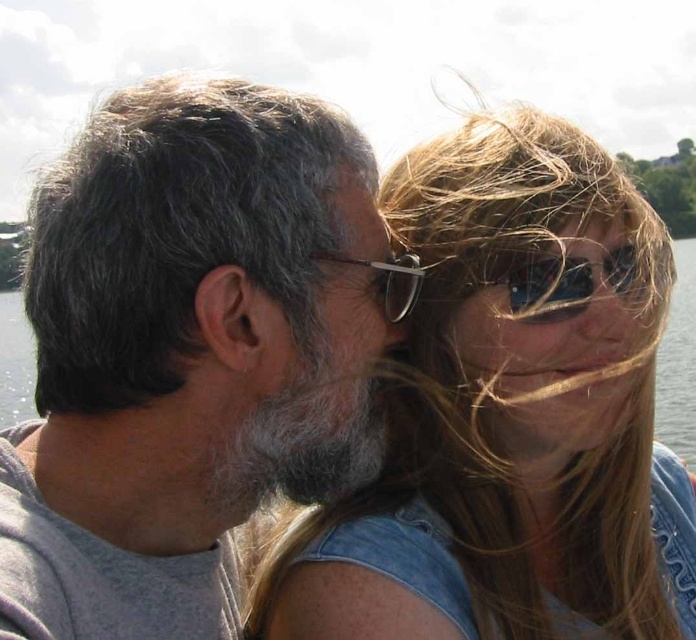
In the scene where a man and a woman are by a body of water, there is a point labeled as point (679, 362). What does this point represent?

The point (679, 362) represents the location of transparent water at center.

In the scene shown: You are a photographer trying to capture a closeup shot of the black plastic goggles at upper center without the denim jacket at upper right overlapping it. Can you position yourself in a way to avoid the overlap?

The denim jacket at upper right is wider than the black plastic goggles at upper center. Since the denim jacket is larger in width, positioning yourself to the side or adjusting the angle might help avoid overlap, but the exact feasibility depends on their exact spatial arrangement not specified here.

You are a photographer trying to capture a closeup of the transparent water at center and the metallic reflective glasses at center in the scene. Given that your camera lens can only focus on objects within 50 meters of each other, will you be able to capture both in a single shot?

The transparent water at center and metallic reflective glasses at center are 48.24 meters apart from each other. Since the distance between them is less than 50 meters, the camera lens can focus on both objects in a single shot.